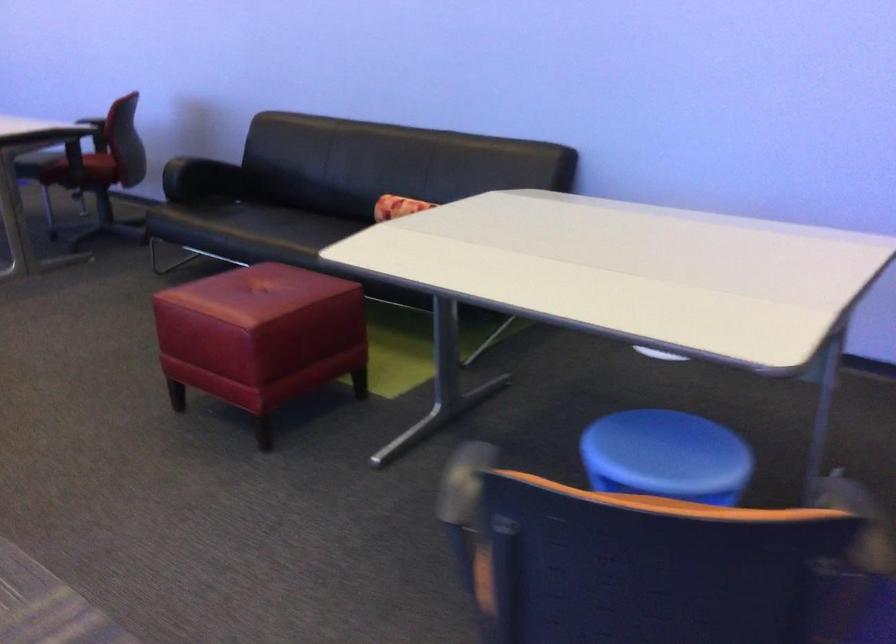
Find the location of a particular element. Image resolution: width=896 pixels, height=644 pixels. blue round stool is located at coordinates (666, 456).